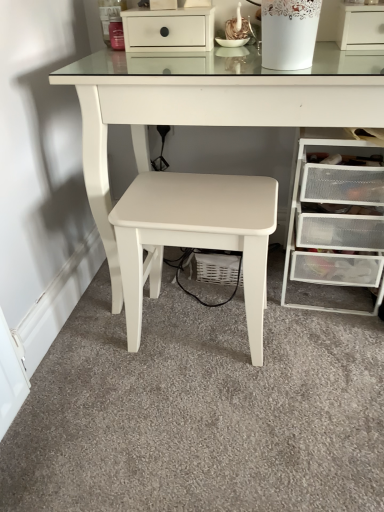
Question: In the image, is white glossy table at center on the left side or the right side of clear plastic drawers at lower right, which appears as the 1th chest of drawers when viewed from the right?

Choices:
 (A) left
 (B) right

Answer: (A)

Question: From a real-world perspective, is white glossy table at center positioned above or below clear plastic drawers at lower right, acting as the second chest of drawers starting from the left?

Choices:
 (A) below
 (B) above

Answer: (B)

Question: Which is farther from the clear plastic drawers at lower right, which appears as the second chest of drawers when viewed from the top?

Choices:
 (A) white glossy table at center
 (B) white matte drawer at upper center, which ranks as the first chest of drawers in left-to-right order
 (C) white matte stool at center
 (D) white porcelain vase at upper center

Answer: (B)

Question: Estimate the real-world distances between objects in this image. Which object is farther from the white matte drawer at upper center, positioned as the first chest of drawers in top-to-bottom order?

Choices:
 (A) white porcelain vase at upper center
 (B) white glossy table at center
 (C) clear plastic drawers at lower right, arranged as the first chest of drawers when ordered from the bottom
 (D) white matte stool at center

Answer: (C)